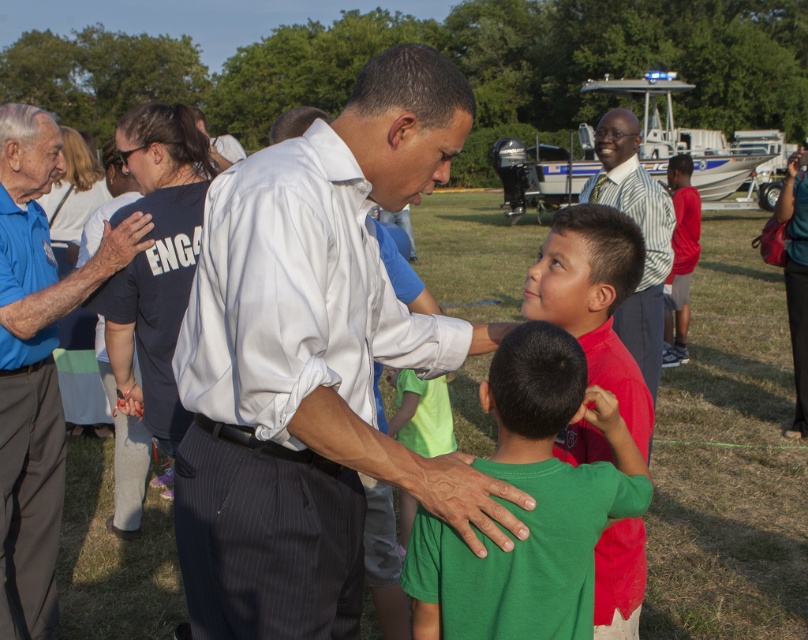
Question: Does white pinstripe shirt at center have a greater width compared to green matte shirt at center?

Choices:
 (A) yes
 (B) no

Answer: (A)

Question: Does matte green shirt at center have a lesser width compared to red matte shirt at right?

Choices:
 (A) no
 (B) yes

Answer: (B)

Question: Based on their relative distances, which object is farther from the matte green shirt at center?

Choices:
 (A) blue shirt at left
 (B) red matte shirt at right

Answer: (B)

Question: Does striped shirt at center have a larger size compared to red matte shirt at right?

Choices:
 (A) yes
 (B) no

Answer: (B)

Question: Estimate the real-world distances between objects in this image. Which object is closer to the green matte shirt at center?

Choices:
 (A) striped shirt at center
 (B) blue shirt at left
 (C) red matte shirt at right

Answer: (B)

Question: Which object is farther from the camera taking this photo?

Choices:
 (A) green matte shirt at center
 (B) red matte shirt at right

Answer: (B)